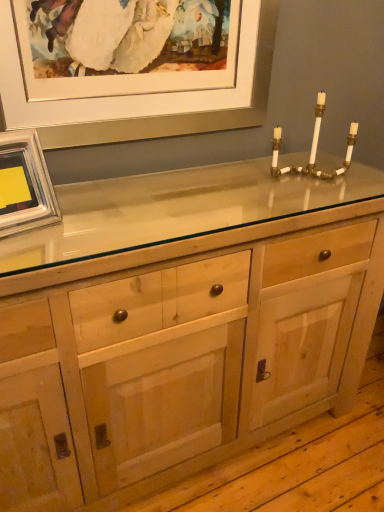
Image resolution: width=384 pixels, height=512 pixels. I want to click on vacant space in between silver metallic picture frame at upper left, arranged as the first picture frame when ordered from the bottom, and white ceramic candle holder at upper right, so pyautogui.click(x=168, y=206).